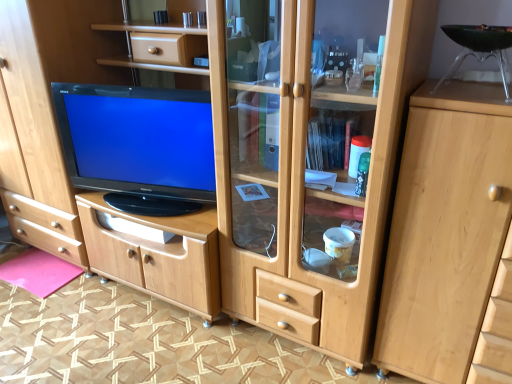
Question: From a real-world perspective, is black glossy television at center below pink felt mat at lower left?

Choices:
 (A) yes
 (B) no

Answer: (B)

Question: Is black glossy television at center not near pink felt mat at lower left?

Choices:
 (A) no
 (B) yes

Answer: (A)

Question: Is black glossy television at center positioned behind pink felt mat at lower left?

Choices:
 (A) no
 (B) yes

Answer: (A)

Question: Does black glossy television at center have a smaller size compared to pink felt mat at lower left?

Choices:
 (A) no
 (B) yes

Answer: (A)

Question: Is black glossy television at center to the left of pink felt mat at lower left from the viewer's perspective?

Choices:
 (A) no
 (B) yes

Answer: (A)

Question: From a real-world perspective, does black glossy television at center stand above pink felt mat at lower left?

Choices:
 (A) yes
 (B) no

Answer: (A)

Question: Is pink felt mat at lower left to the left of light wood cabinet at right from the viewer's perspective?

Choices:
 (A) no
 (B) yes

Answer: (B)

Question: Is pink felt mat at lower left beside light wood cabinet at right?

Choices:
 (A) yes
 (B) no

Answer: (B)

Question: Is pink felt mat at lower left taller than light wood cabinet at right?

Choices:
 (A) yes
 (B) no

Answer: (B)

Question: From the image's perspective, is pink felt mat at lower left on light wood cabinet at right?

Choices:
 (A) yes
 (B) no

Answer: (B)

Question: Does pink felt mat at lower left have a greater width compared to light wood cabinet at right?

Choices:
 (A) yes
 (B) no

Answer: (B)

Question: Are pink felt mat at lower left and light wood cabinet at right far apart?

Choices:
 (A) no
 (B) yes

Answer: (B)

Question: From a real-world perspective, is pink felt mat at lower left over black glossy television at center?

Choices:
 (A) no
 (B) yes

Answer: (A)